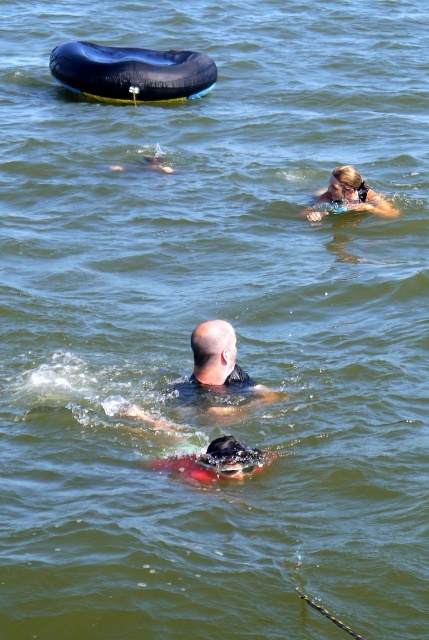
Between dark gray rubber swim cap at center and blonde hair swimmer at upper right, which one has less height?

dark gray rubber swim cap at center is shorter.

Does dark gray rubber swim cap at center appear over blonde hair swimmer at upper right?

No.

The width and height of the screenshot is (429, 640). What do you see at coordinates (217, 461) in the screenshot? I see `dark gray rubber swim cap at center` at bounding box center [217, 461].

Where is `dark gray rubber swim cap at center`? dark gray rubber swim cap at center is located at coordinates (217, 461).

Is bald head at center to the right of blonde hair swimmer at upper right from the viewer's perspective?

Incorrect, bald head at center is not on the right side of blonde hair swimmer at upper right.

Is point (239, 410) closer to viewer compared to point (337, 177)?

Yes.

Locate an element on the screen. The image size is (429, 640). bald head at center is located at coordinates (218, 371).

Is the position of bald head at center less distant than that of dark gray rubber swim cap at center?

No, bald head at center is further to the viewer.

Does bald head at center appear over dark gray rubber swim cap at center?

Indeed, bald head at center is positioned over dark gray rubber swim cap at center.

You are a GUI agent. You are given a task and a screenshot of the screen. Output one action in this format:
    pyautogui.click(x=<x>, y=<y>)
    Task: Click on the bald head at center
    
    Given the screenshot: What is the action you would take?
    pyautogui.click(x=218, y=371)